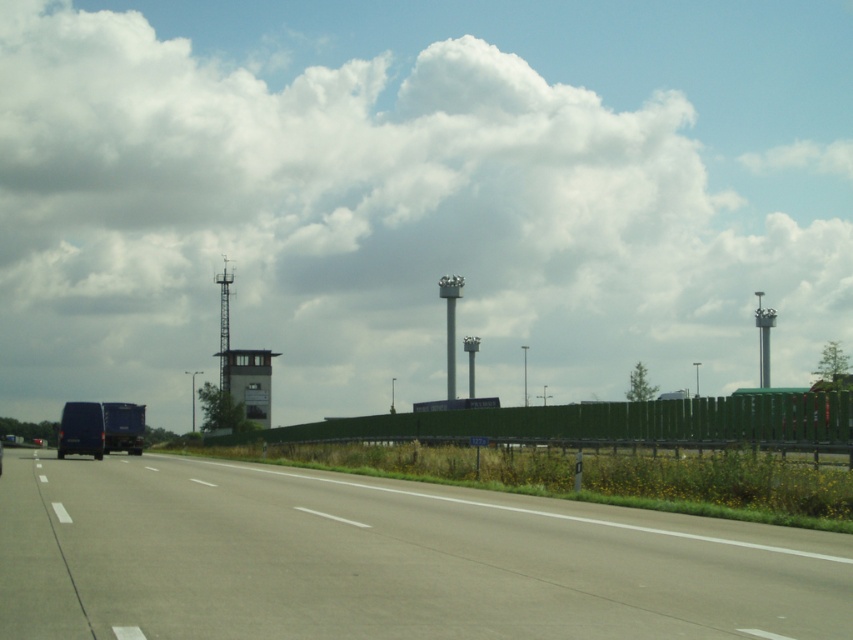
Question: Does gray asphalt highway at center appear on the left side of matte black van at center?

Choices:
 (A) yes
 (B) no

Answer: (B)

Question: Which point appears farthest from the camera in this image?

Choices:
 (A) (93, 440)
 (B) (223, 392)

Answer: (B)

Question: From the image, what is the correct spatial relationship of white fluffy cloud at upper center in relation to metallic gray control tower at center?

Choices:
 (A) left
 (B) right

Answer: (B)

Question: Which point is farther from the camera taking this photo?

Choices:
 (A) (224, 310)
 (B) (378, 29)

Answer: (B)

Question: Can you confirm if matte black van at center is positioned above metallic gray control tower at center?

Choices:
 (A) no
 (B) yes

Answer: (A)

Question: Which is farther from the gray asphalt highway at center?

Choices:
 (A) white fluffy cloud at upper center
 (B) metallic gray control tower at center

Answer: (A)